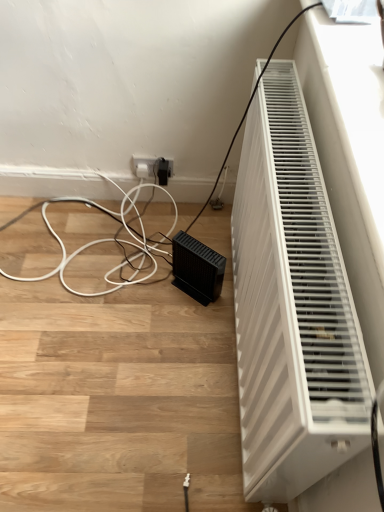
Question: Can you confirm if white plastic radiator at right is shorter than black matte speaker at lower center?

Choices:
 (A) no
 (B) yes

Answer: (A)

Question: From a real-world perspective, does white plastic radiator at right stand above black matte speaker at lower center?

Choices:
 (A) yes
 (B) no

Answer: (A)

Question: Would you say white plastic radiator at right is outside black matte speaker at lower center?

Choices:
 (A) no
 (B) yes

Answer: (B)

Question: Can you confirm if white plastic radiator at right is wider than black matte speaker at lower center?

Choices:
 (A) yes
 (B) no

Answer: (B)

Question: Is the depth of white plastic radiator at right less than that of black matte speaker at lower center?

Choices:
 (A) no
 (B) yes

Answer: (B)

Question: Is white plastic radiator at right looking in the opposite direction of black matte speaker at lower center?

Choices:
 (A) no
 (B) yes

Answer: (B)

Question: Does black matte speaker at lower center appear on the left side of white plastic radiator at right?

Choices:
 (A) no
 (B) yes

Answer: (B)

Question: Can you confirm if black matte speaker at lower center is thinner than white plastic radiator at right?

Choices:
 (A) no
 (B) yes

Answer: (A)

Question: Is black matte speaker at lower center closer to camera compared to white plastic radiator at right?

Choices:
 (A) yes
 (B) no

Answer: (B)

Question: Does black matte speaker at lower center contain white plastic radiator at right?

Choices:
 (A) no
 (B) yes

Answer: (A)

Question: Is black matte speaker at lower center smaller than white plastic radiator at right?

Choices:
 (A) no
 (B) yes

Answer: (B)

Question: Can we say black matte speaker at lower center lies outside white plastic radiator at right?

Choices:
 (A) no
 (B) yes

Answer: (B)

Question: From the image's perspective, is black matte speaker at lower center positioned above or below white plastic radiator at right?

Choices:
 (A) below
 (B) above

Answer: (B)